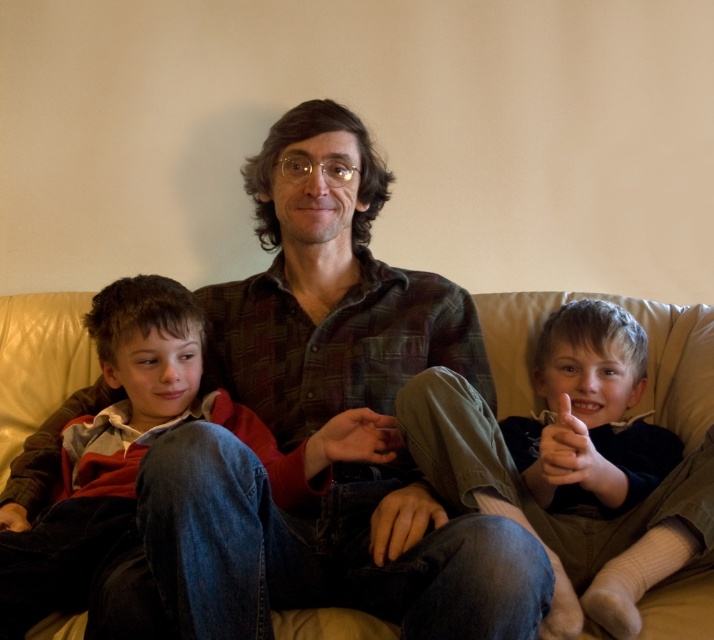
You are standing in a living room and want to move from the point at coordinates (658, 563) to the point at coordinates (1, 326). Which direction should you move to get closer to your destination?

To move from point (658, 563) to point (1, 326), you should move downward and to the left since the destination point is lower and to the left compared to the starting point.

Looking at this image, you are a photographer setting up for a family portrait. You need to ensure that the light brown cotton pants at right and the beige leather couch at center are both visible in the frame. Given their heights, which object should you adjust your camera angle to focus on first to capture both?

The light brown cotton pants at right is taller than the beige leather couch at center, so you should adjust your camera angle to focus on the light brown cotton pants at right first to ensure both are visible.